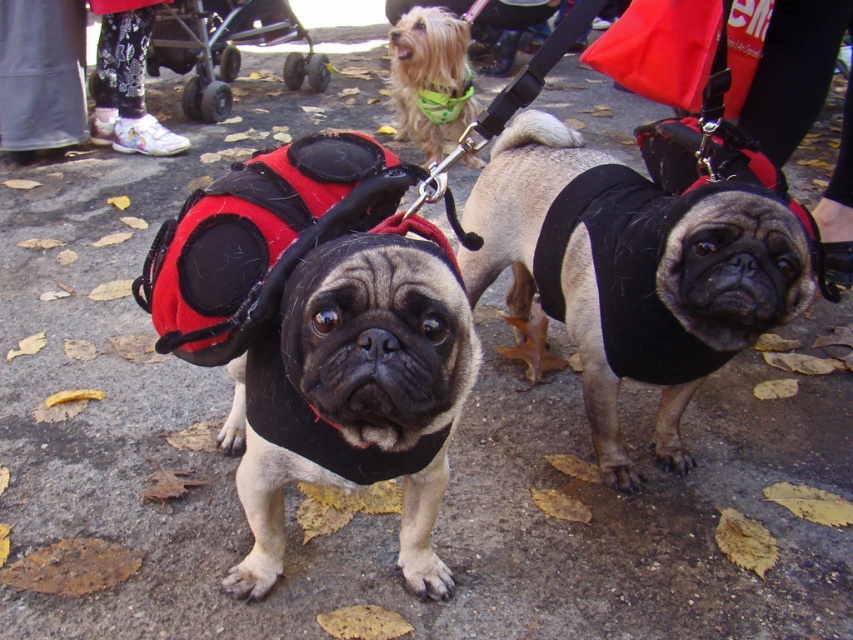
You are a photographer trying to capture a clear shot of the black fleece vest at center and the black plastic baby carriage at upper left. Which object should you focus on first if you want to ensure both are in focus without adjusting the camera settings?

The black fleece vest at center is below the black plastic baby carriage at upper left, so focusing on the black plastic baby carriage at upper left first would ensure both are in focus as it is closer to the camera.

You are a photographer trying to capture a photo of the black fleece vest at center and the black plastic baby carriage at upper left. Which object should you focus on first if you want to ensure both are in the frame without moving the camera? Explain your reasoning.

The black fleece vest at center is shorter than the black plastic baby carriage at upper left. Therefore, you should focus on the black plastic baby carriage at upper left first because it is taller, ensuring it fits within the frame before adjusting for the shorter vest.

You are a photographer trying to capture a photo of the black soft vest at center and the shiny green bandana at upper center. Which object should you focus on first if you want to ensure both are in focus without adjusting the camera settings?

The black soft vest at center is located below the shiny green bandana at upper center. Since they are at different heights, you should focus on the shiny green bandana at upper center first because it is higher up, allowing the camera to capture both objects in focus by using the depth of field starting from the front object.